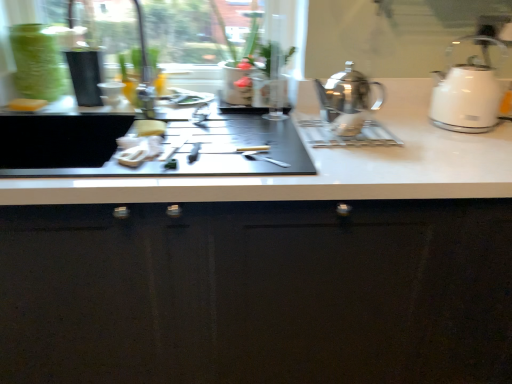
Image resolution: width=512 pixels, height=384 pixels. I want to click on vacant space to the right of shiny metallic kettle at center, the second kettle when ordered from right to left, so (x=416, y=141).